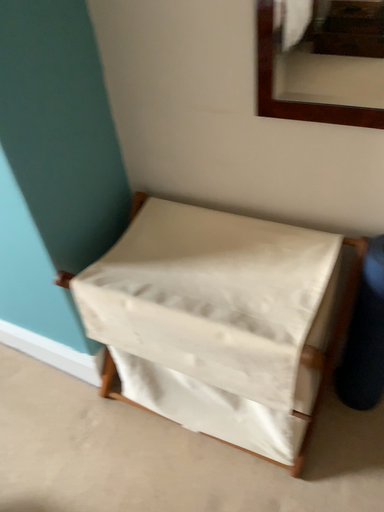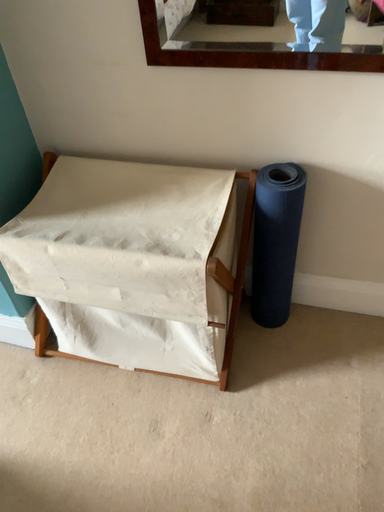
Question: How did the camera likely rotate when shooting the video?

Choices:
 (A) rotated right
 (B) rotated left

Answer: (A)